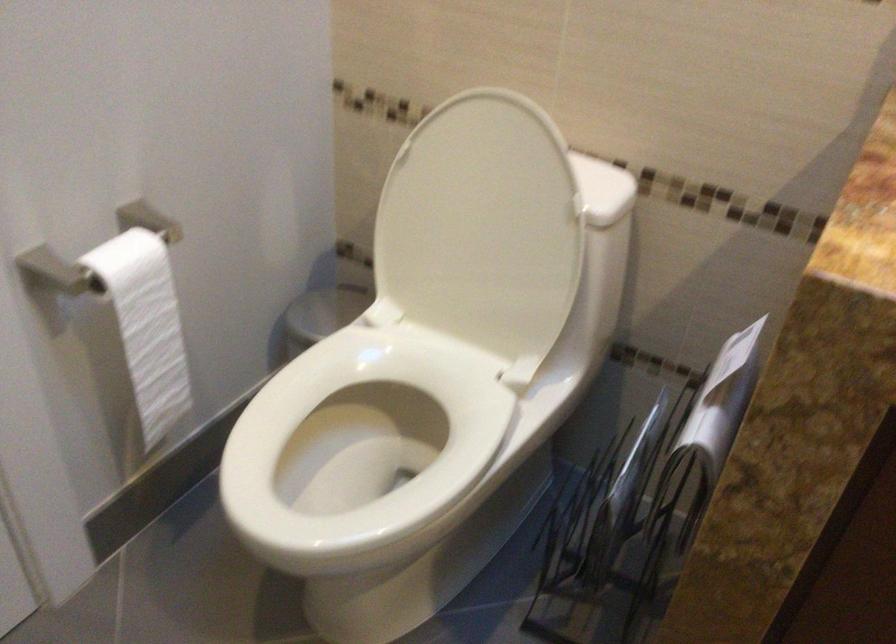
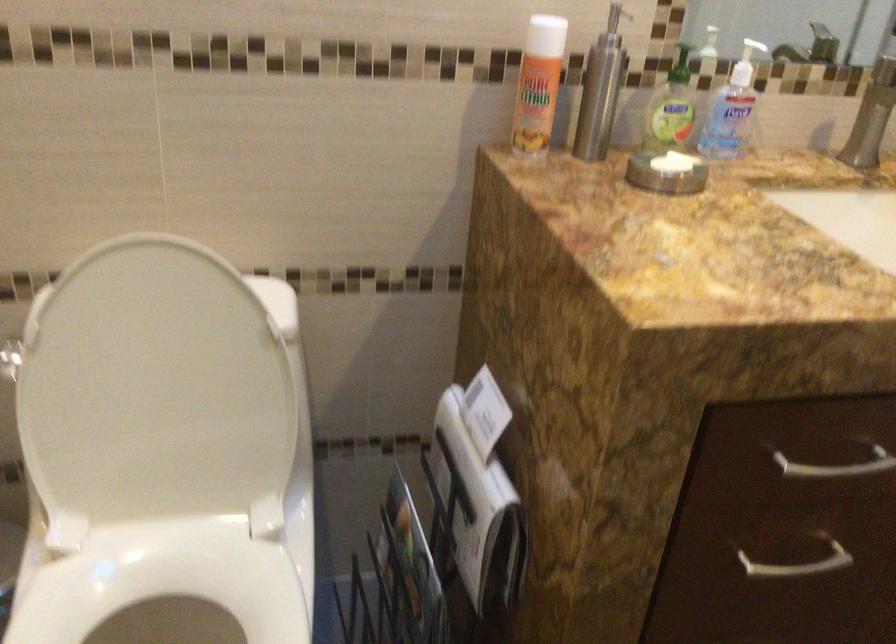
The point at (472, 225) is marked in the first image. Where is the corresponding point in the second image?

(152, 391)